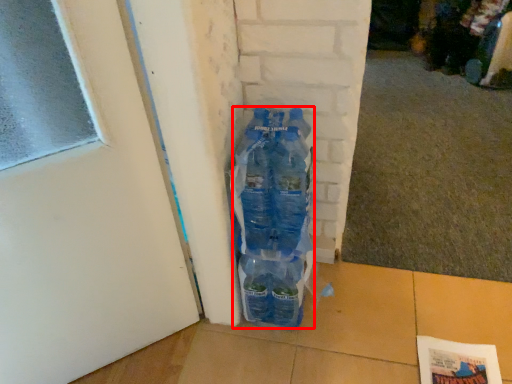
Question: Where is bottle (annotated by the red box) located in relation to door in the image?

Choices:
 (A) left
 (B) right

Answer: (B)